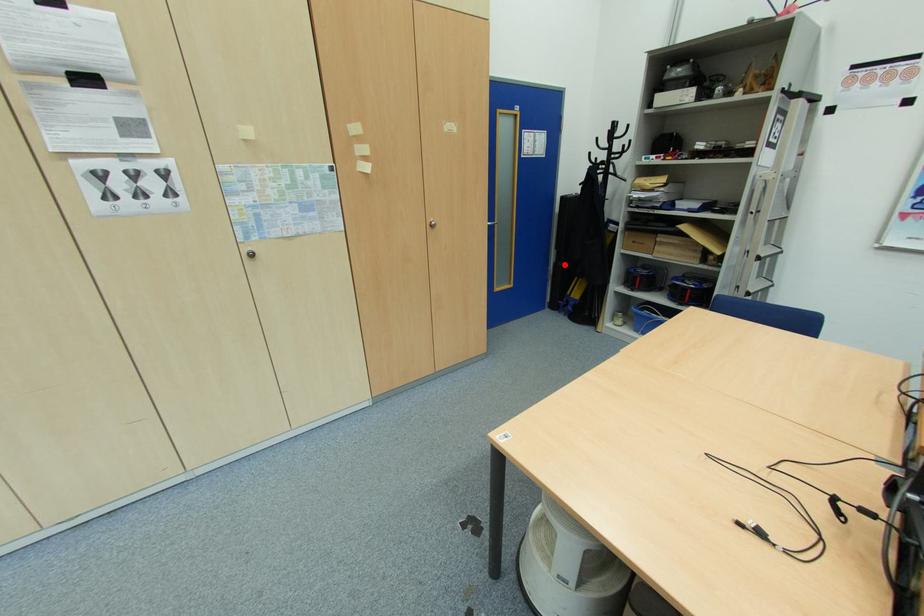
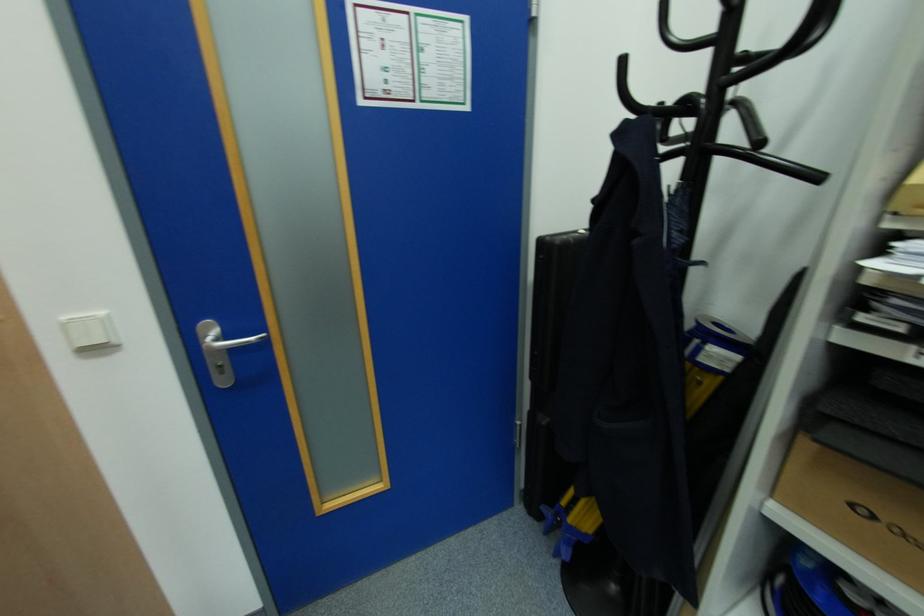
Question: I am providing you with two images of the same scene from different viewpoints. A red point is marked on the first image. Can you still see the location of the red point in image 2?

Choices:
 (A) Yes
 (B) No

Answer: (A)